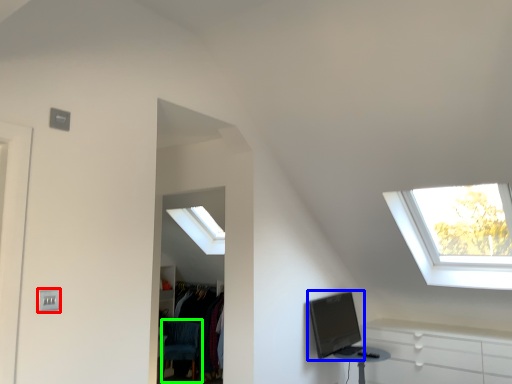
Question: Estimate the real-world distances between objects in this image. Which object is farther from electric outlet (highlighted by a red box), computer monitor (highlighted by a blue box) or swivel chair (highlighted by a green box)?

Choices:
 (A) computer monitor
 (B) swivel chair

Answer: (B)